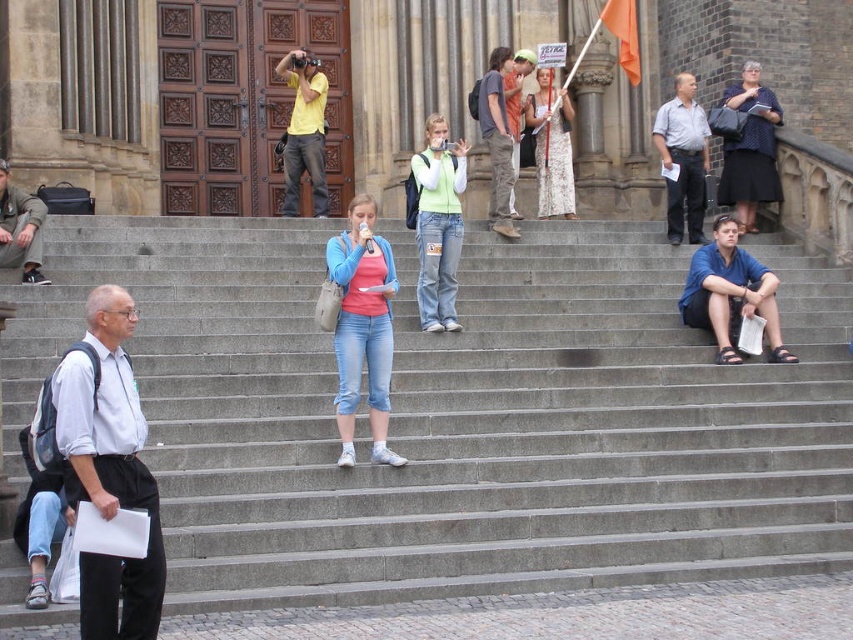
You are a photographer trying to capture a group photo of the pink fabric shirt at center and the white lace dress at center. Which one should you focus on first if you want to include both in the frame without moving the camera?

The pink fabric shirt at center is positioned on the left side of white lace dress at center, so you should focus on the pink fabric shirt at center first to ensure both are included in the frame without moving the camera.